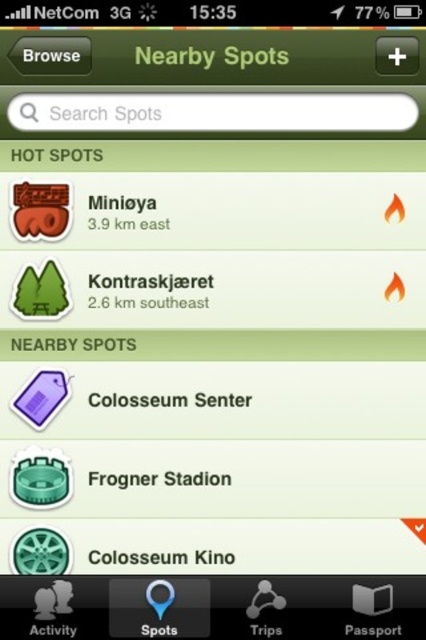
Consider the image. Which is more to the right, white paper colosseum senter at center or black matte colosseum kino at center?

Positioned to the right is white paper colosseum senter at center.

Is white paper colosseum senter at center further to camera compared to black matte colosseum kino at center?

Yes, white paper colosseum senter at center is further from the viewer.

Identify the location of white paper colosseum senter at center. (137, 401).

Measure the distance between black matte colosseum kino at center and camera.

black matte colosseum kino at center and camera are 1.23 meters apart.

Does point (215, 557) come farther from viewer compared to point (48, 340)?

No, (215, 557) is in front of (48, 340).

You are a GUI agent. You are given a task and a screenshot of the screen. Output one action in this format:
    pyautogui.click(x=<x>, y=<y>)
    Task: Click on the black matte colosseum kino at center
    The width and height of the screenshot is (426, 640).
    Given the screenshot: What is the action you would take?
    pyautogui.click(x=135, y=557)

Does white paper colosseum senter at center appear over green matte sign at center?

No.

Does white paper colosseum senter at center have a lesser width compared to green matte sign at center?

Incorrect, white paper colosseum senter at center's width is not less than green matte sign at center's.

Locate an element on the screen. This screenshot has height=640, width=426. white paper colosseum senter at center is located at coordinates (137, 401).